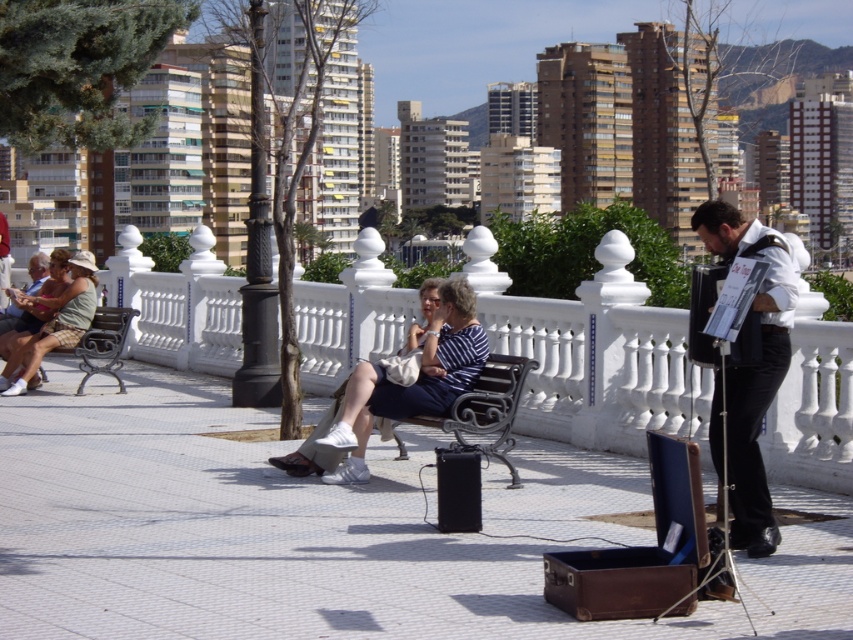
Based on the photo, you are a photographer planning to take a photo of the matte green dress at left and the black wrought iron bench at left. Based on their positions, which object should you focus on first to ensure both are in frame?

The matte green dress at left is positioned on the left side of the black wrought iron bench at left, so you should focus on the matte green dress at left first to ensure both are in frame.

You are a delivery drone that needs to land on the white tile pavement at center. What are the coordinates of the landing spot?

The white tile pavement at center is located at point [279,528], so the drone should land there.